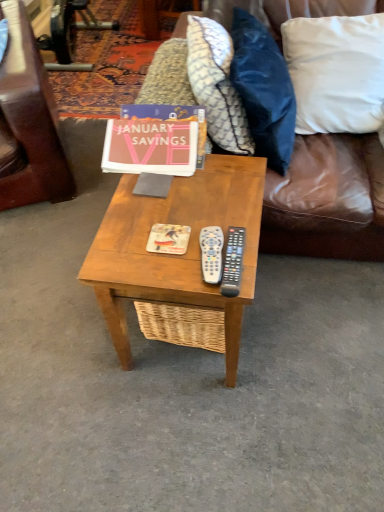
Question: From a real-world perspective, is white plastic remote at center, which is the first remote from left to right, above or below brown leather couch at upper right?

Choices:
 (A) below
 (B) above

Answer: (B)

Question: Is white plastic remote at center, marked as the second remote in a right-to-left arrangement, situated inside brown leather couch at upper right or outside?

Choices:
 (A) outside
 (B) inside

Answer: (A)

Question: Based on their relative distances, which object is farther from the matte orange magazine at center?

Choices:
 (A) white cotton pillow at upper right, the first pillow viewed from the right
 (B) black plastic remote at right, marked as the first remote in a right-to-left arrangement
 (C) white plastic remote at center, marked as the second remote in a right-to-left arrangement
 (D) pink matte paper at center
 (E) white fabric pillow at upper right, which appears as the second pillow when viewed from the right

Answer: (A)

Question: Which of these objects is positioned closest to the matte orange magazine at center?

Choices:
 (A) woodenwoodencoffee table at center
 (B) patterned fabric pillow at upper center, marked as the 1th pillow in a left-to-right arrangement
 (C) white cotton pillow at upper right, the first pillow viewed from the right
 (D) pink matte paper at center
 (E) brown leather couch at upper right

Answer: (A)